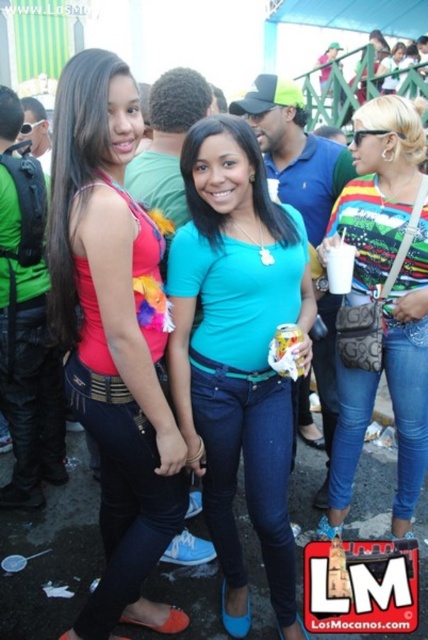
Does point (79, 292) come in front of point (253, 273)?

Yes, point (79, 292) is in front of point (253, 273).

Which of these two, matte red tank top at left or matte teal shirt at center, stands taller?

With more height is matte red tank top at left.

Between point (112, 362) and point (244, 468), which one is positioned in front?

Point (112, 362)

Identify the location of matte red tank top at left. (113, 337).

Is matte red tank top at left taller than multicolored jersey at center?

Indeed, matte red tank top at left has a greater height compared to multicolored jersey at center.

Can you confirm if matte red tank top at left is positioned to the right of multicolored jersey at center?

Incorrect, matte red tank top at left is not on the right side of multicolored jersey at center.

At what (x,y) coordinates should I click in order to perform the action: click on matte red tank top at left. Please return your answer as a coordinate pair (x, y). This screenshot has height=640, width=428. Looking at the image, I should click on (x=113, y=337).

Is the position of matte teal shirt at center less distant than that of multicolored jersey at center?

Yes, matte teal shirt at center is in front of multicolored jersey at center.

Who is positioned more to the right, matte teal shirt at center or multicolored jersey at center?

multicolored jersey at center

What do you see at coordinates (237, 353) in the screenshot? Image resolution: width=428 pixels, height=640 pixels. I see `matte teal shirt at center` at bounding box center [237, 353].

Image resolution: width=428 pixels, height=640 pixels. What are the coordinates of `matte teal shirt at center` in the screenshot? It's located at (237, 353).